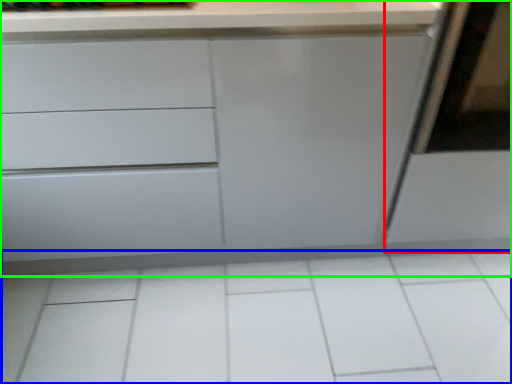
Question: Which is nearer to the screen door (highlighted by a red box)? ceramic tile (highlighted by a blue box) or chest of drawers (highlighted by a green box).

Choices:
 (A) ceramic tile
 (B) chest of drawers

Answer: (B)